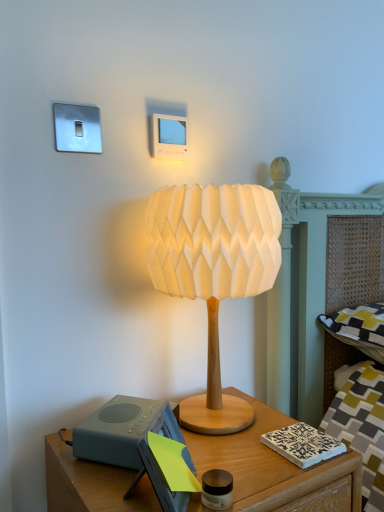
Question: Is wooden nightstand at lower center not inside white paper lampshade at center?

Choices:
 (A) yes
 (B) no

Answer: (A)

Question: Does wooden nightstand at lower center have a lesser height compared to white paper lampshade at center?

Choices:
 (A) no
 (B) yes

Answer: (B)

Question: Considering the relative positions of wooden nightstand at lower center and white paper lampshade at center in the image provided, is wooden nightstand at lower center to the left of white paper lampshade at center from the viewer's perspective?

Choices:
 (A) yes
 (B) no

Answer: (A)

Question: From a real-world perspective, is wooden nightstand at lower center located higher than white paper lampshade at center?

Choices:
 (A) yes
 (B) no

Answer: (B)

Question: Is the position of wooden nightstand at lower center more distant than that of white paper lampshade at center?

Choices:
 (A) no
 (B) yes

Answer: (A)

Question: From the image's perspective, is wooden nightstand at lower center above or below white paper lampshade at center?

Choices:
 (A) below
 (B) above

Answer: (A)

Question: Considering the positions of wooden nightstand at lower center and white paper lampshade at center in the image, is wooden nightstand at lower center wider or thinner than white paper lampshade at center?

Choices:
 (A) thin
 (B) wide

Answer: (B)

Question: Is wooden nightstand at lower center taller or shorter than white paper lampshade at center?

Choices:
 (A) short
 (B) tall

Answer: (A)

Question: Based on their positions, is wooden nightstand at lower center located to the left or right of white paper lampshade at center?

Choices:
 (A) right
 (B) left

Answer: (B)

Question: Does point (211, 248) appear closer or farther from the camera than point (77, 426)?

Choices:
 (A) closer
 (B) farther

Answer: (A)

Question: Based on their positions, is white paper lampshade at center located to the left or right of gray matte speaker at lower left?

Choices:
 (A) right
 (B) left

Answer: (A)

Question: Is white paper lampshade at center wider or thinner than gray matte speaker at lower left?

Choices:
 (A) wide
 (B) thin

Answer: (A)

Question: Is white paper lampshade at center inside the boundaries of gray matte speaker at lower left, or outside?

Choices:
 (A) outside
 (B) inside

Answer: (A)

Question: Is gray matte speaker at lower left to the left or to the right of wooden nightstand at lower center in the image?

Choices:
 (A) left
 (B) right

Answer: (A)

Question: Choose the correct answer: Is gray matte speaker at lower left inside wooden nightstand at lower center or outside it?

Choices:
 (A) inside
 (B) outside

Answer: (B)